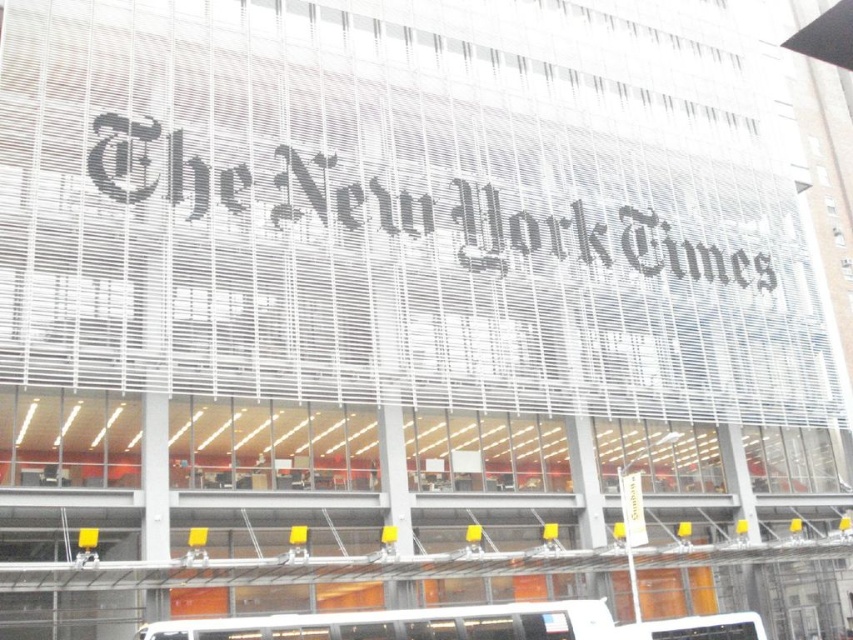
Can you confirm if black paper at center is positioned to the left of white matte tour bus at lower center?

In fact, black paper at center is to the right of white matte tour bus at lower center.

Is black paper at center below white matte tour bus at lower center?

Incorrect, black paper at center is not positioned below white matte tour bus at lower center.

Identify the location of black paper at center. (503, 225).